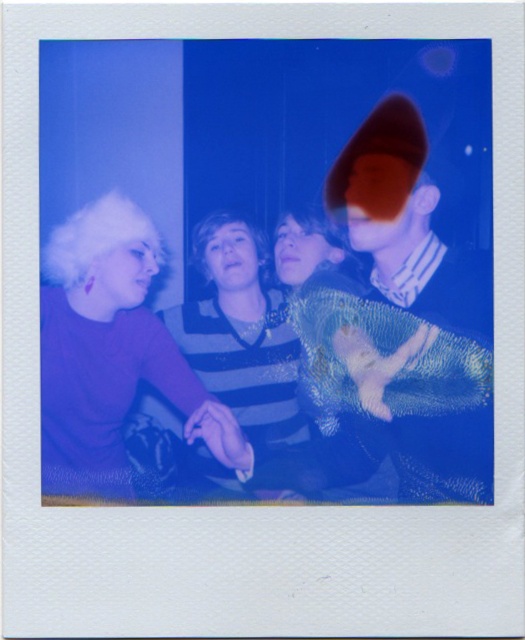
You are holding a ruler and want to measure the distance between the purple matte shirt at left and the purple shiny sweater at center in the Polaroid photo. How far apart are they?

The purple matte shirt at left is 2.78 inches from the purple shiny sweater at center, so they are 2.78 inches apart.

You are standing in front of a vintage Polaroid photo with four people. You notice two points marked on the image at coordinates point (136, 371) and point (282, 436). Which point is closer to you?

Point (136, 371) is in front of point (282, 436), so it is closer to you.